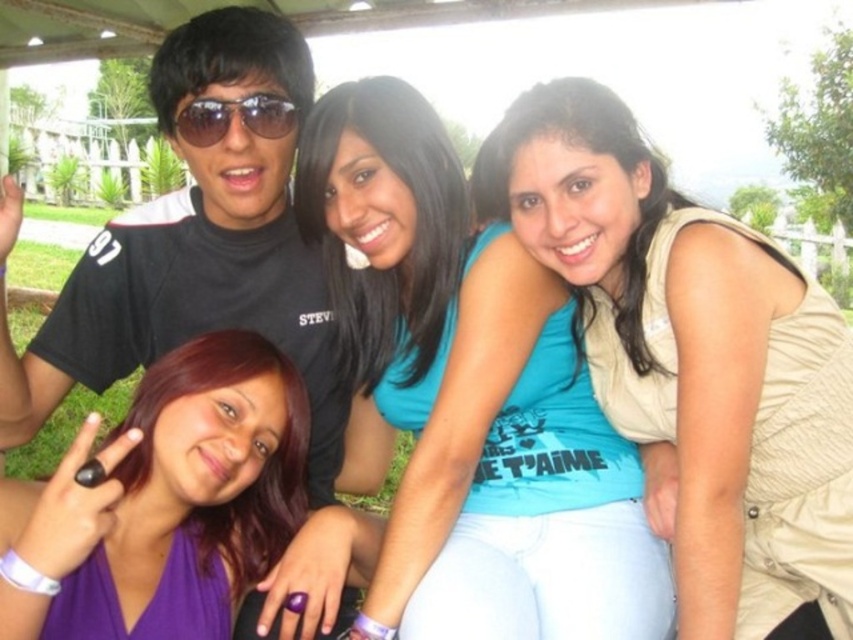
You are a photographer trying to capture a photo of the blue fabric shirt at center and the purple fabric dress at lower left. To ensure both subjects are in focus, you need to know their relative positions. Which clothing item is closer to the camera?

The purple fabric dress at lower left is behind the blue fabric shirt at center, so the blue fabric shirt at center is closer to the camera.

You are standing in the park and see two points in the image. The first point is at coordinates point (622,131) and the second is at point (219,536). Which point is closer to you?

Point (622,131) is further to the viewer than point (219,536), so the second point is closer to you.